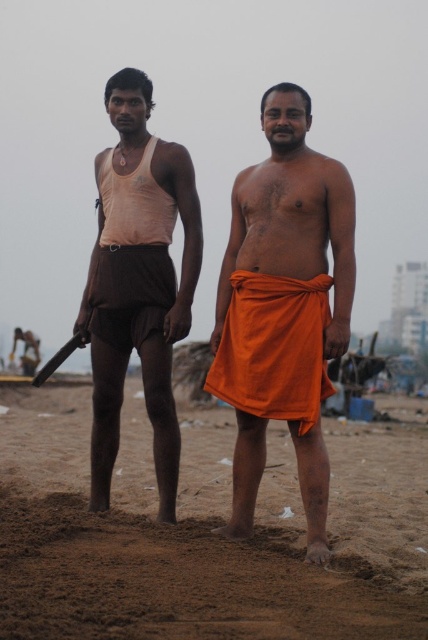
Who is lower down, orange cloth at center or matte brown shorts at left?

orange cloth at center is lower down.

Does point (312, 481) lie in front of point (165, 332)?

Yes, it is.

Find the location of a particular element. The width and height of the screenshot is (428, 640). orange cloth at center is located at coordinates (285, 298).

Does point (18, 579) come farther from viewer compared to point (244, 417)?

That is False.

Looking at this image, does brown sandy feet at lower center have a lesser height compared to orange cloth at center?

Indeed, brown sandy feet at lower center has a lesser height compared to orange cloth at center.

Is point (202, 637) positioned after point (243, 445)?

No, it is not.

The width and height of the screenshot is (428, 640). Identify the location of brown sandy feet at lower center. [x=207, y=531].

In the scene shown: Can you confirm if brown sandy feet at lower center is taller than matte brown shorts at left?

No.

Describe the element at coordinates (207, 531) in the screenshot. I see `brown sandy feet at lower center` at that location.

At what (x,y) coordinates should I click in order to perform the action: click on brown sandy feet at lower center. Please return your answer as a coordinate pair (x, y). The image size is (428, 640). Looking at the image, I should click on (207, 531).